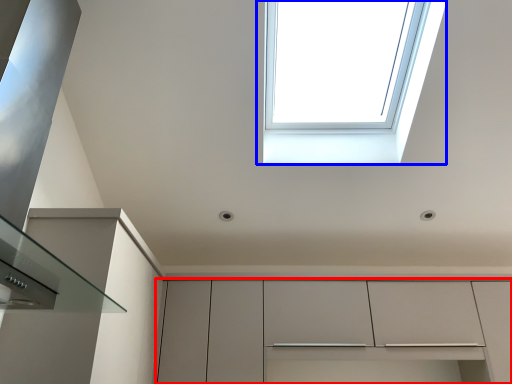
Question: Which object appears farthest to the camera in this image, cabinetry (highlighted by a red box) or window (highlighted by a blue box)?

Choices:
 (A) cabinetry
 (B) window

Answer: (A)